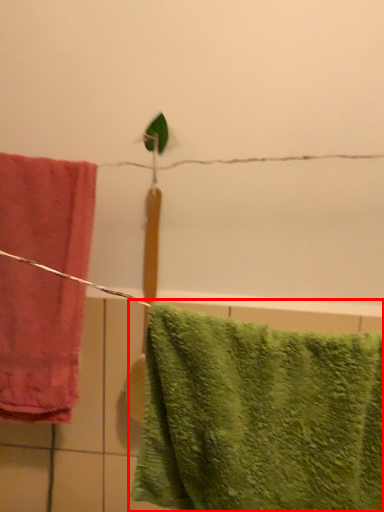
Question: Considering the relative positions of towel (annotated by the red box) and towel in the image provided, where is towel (annotated by the red box) located with respect to the staircase?

Choices:
 (A) left
 (B) right

Answer: (B)